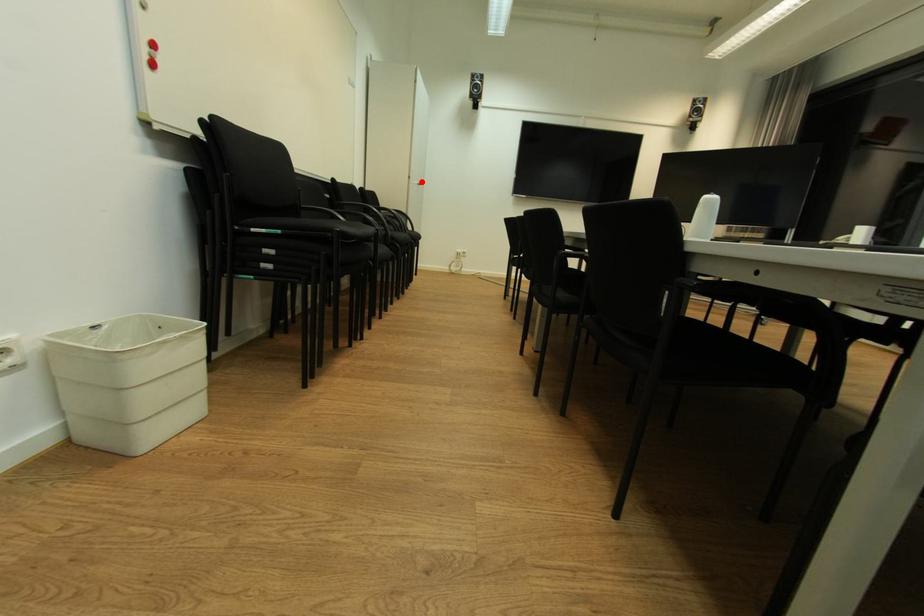
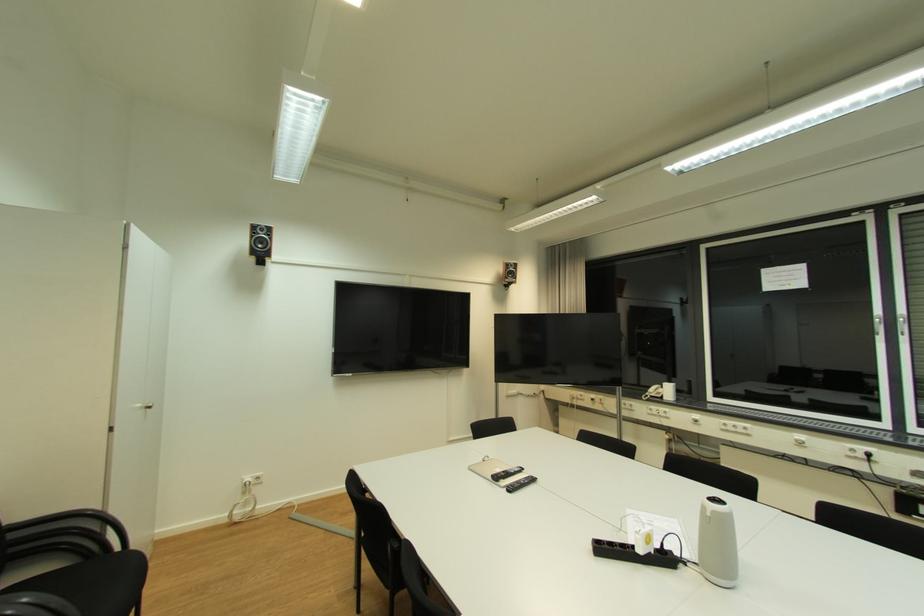
Where in the second image is the point corresponding to the highlighted location from the first image?

(146, 407)